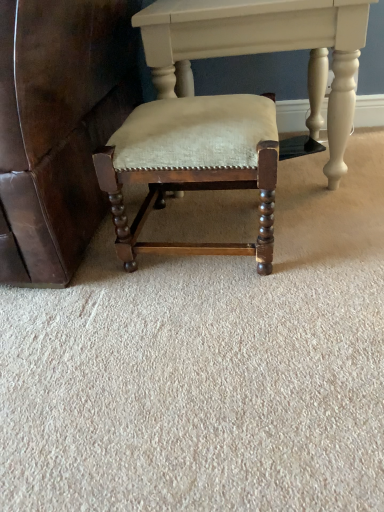
What are the coordinates of `space that is in front of matte wood chair at center` in the screenshot? It's located at (213, 323).